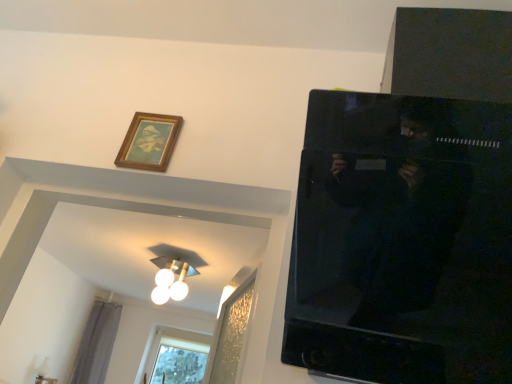
Question: Is wooden picture frame at upper left bigger or smaller than gray fabric curtain at lower left?

Choices:
 (A) small
 (B) big

Answer: (A)

Question: Is wooden picture frame at upper left inside or outside of gray fabric curtain at lower left?

Choices:
 (A) inside
 (B) outside

Answer: (B)

Question: Which of these objects is positioned farthest from the clear glass window at lower left?

Choices:
 (A) gray fabric curtain at lower left
 (B) white glossy light fixture at upper center
 (C) wooden picture frame at upper left

Answer: (C)

Question: Which object is positioned farthest from the clear glass window at lower left?

Choices:
 (A) white glossy light fixture at upper center
 (B) gray fabric curtain at lower left
 (C) wooden picture frame at upper left

Answer: (C)